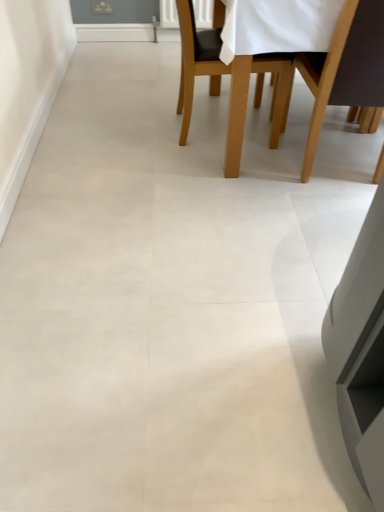
Locate an element on the screen. vacant area situated below light brown wooden chair at upper center, acting as the 2th chair starting from the right (from a real-world perspective) is located at coordinates (196, 126).